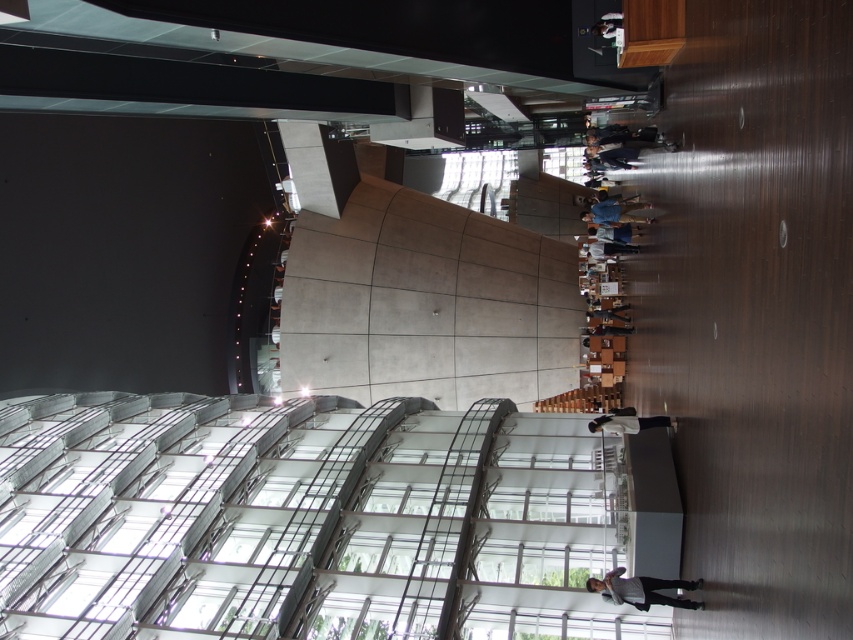
What is located at the point with coordinates (618, 211) in the image?

The point at coordinates (618, 211) indicates the location of the denim jacket at center.